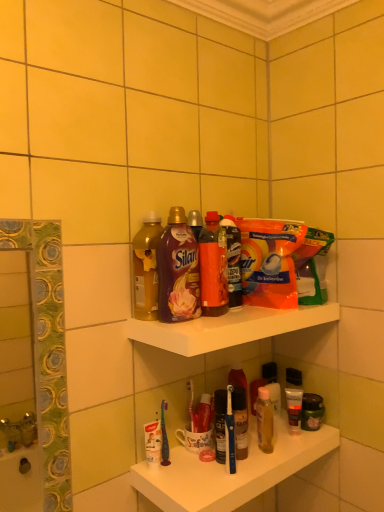
At what (x,y) coordinates should I click in order to perform the action: click on vacant space underneath white glossy shelf at upper center, marked as the 2th shelf in a bottom-to-top arrangement (from a real-world perspective). Please return your answer as a coordinate pair (x, y). Looking at the image, I should click on (237, 460).